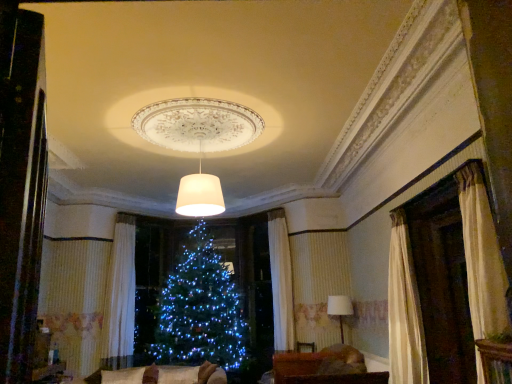
Question: Is brown fabric couch at lower center turned away from velvet beige couch at lower center?

Choices:
 (A) yes
 (B) no

Answer: (B)

Question: Is brown fabric couch at lower center thinner than velvet beige couch at lower center?

Choices:
 (A) yes
 (B) no

Answer: (A)

Question: Can you confirm if brown fabric couch at lower center is taller than velvet beige couch at lower center?

Choices:
 (A) yes
 (B) no

Answer: (B)

Question: Is the depth of brown fabric couch at lower center greater than that of velvet beige couch at lower center?

Choices:
 (A) yes
 (B) no

Answer: (A)

Question: Is brown fabric couch at lower center to the left of velvet beige couch at lower center from the viewer's perspective?

Choices:
 (A) no
 (B) yes

Answer: (A)

Question: Based on their positions, is white textured curtain at left located to the left or right of velvet beige couch at lower center?

Choices:
 (A) right
 (B) left

Answer: (B)

Question: Is white textured curtain at left inside or outside of velvet beige couch at lower center?

Choices:
 (A) outside
 (B) inside

Answer: (A)

Question: Considering the positions of white textured curtain at left and velvet beige couch at lower center in the image, is white textured curtain at left wider or thinner than velvet beige couch at lower center?

Choices:
 (A) wide
 (B) thin

Answer: (B)

Question: From the image's perspective, is white textured curtain at left above or below velvet beige couch at lower center?

Choices:
 (A) above
 (B) below

Answer: (A)

Question: Considering the relative positions of white fabric lampshade at right, positioned as the 2th lamp in top-to-bottom order, and white matte lampshade at center, which is the second lamp from back to front, in the image provided, is white fabric lampshade at right, positioned as the 2th lamp in top-to-bottom order, to the left or to the right of white matte lampshade at center, which is the second lamp from back to front,?

Choices:
 (A) left
 (B) right

Answer: (B)

Question: Is white fabric lampshade at right, the 1th lamp viewed from the right, wider or thinner than white matte lampshade at center, which is counted as the 2th lamp, starting from the bottom?

Choices:
 (A) wide
 (B) thin

Answer: (B)

Question: Is point (339, 327) closer or farther from the camera than point (212, 180)?

Choices:
 (A) closer
 (B) farther

Answer: (B)

Question: Is white fabric lampshade at right, positioned as the 2th lamp in top-to-bottom order, taller or shorter than white matte lampshade at center, which is the first lamp from top to bottom?

Choices:
 (A) short
 (B) tall

Answer: (B)

Question: Is point (195, 188) closer or farther from the camera than point (223, 370)?

Choices:
 (A) closer
 (B) farther

Answer: (A)

Question: From a real-world perspective, is white matte lampshade at center, positioned as the 1th lamp in front-to-back order, positioned above or below velvet beige couch at lower center?

Choices:
 (A) below
 (B) above

Answer: (B)